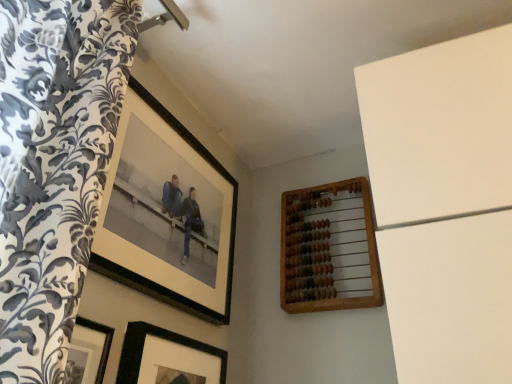
Question: Can you confirm if black matte picture frame at lower center, acting as the second picture frame starting from the left, is wider than black matte picture frame at upper left, which is the first picture frame in left-to-right order?

Choices:
 (A) yes
 (B) no

Answer: (A)

Question: Is black matte picture frame at lower center, which is counted as the second picture frame, starting from the right, oriented towards black matte picture frame at upper left, which is the first picture frame in left-to-right order?

Choices:
 (A) no
 (B) yes

Answer: (A)

Question: Considering the relative positions of black matte picture frame at lower center, acting as the second picture frame starting from the left, and black matte picture frame at upper left, which is the first picture frame in left-to-right order, in the image provided, is black matte picture frame at lower center, acting as the second picture frame starting from the left, to the right of black matte picture frame at upper left, which is the first picture frame in left-to-right order, from the viewer's perspective?

Choices:
 (A) no
 (B) yes

Answer: (B)

Question: Is black matte picture frame at lower center, acting as the second picture frame starting from the left, outside black matte picture frame at upper left, which is the first picture frame in left-to-right order?

Choices:
 (A) yes
 (B) no

Answer: (A)

Question: Can you confirm if black matte picture frame at lower center, which is counted as the second picture frame, starting from the right, is taller than black matte picture frame at upper left, which is the first picture frame in left-to-right order?

Choices:
 (A) yes
 (B) no

Answer: (B)

Question: From the image's perspective, is wooden abacus at upper right, which is counted as the 1th picture frame, starting from the right, above or below black matte picture frame at upper left, which is the first picture frame in left-to-right order?

Choices:
 (A) above
 (B) below

Answer: (B)

Question: Considering the positions of wooden abacus at upper right, which is counted as the 1th picture frame, starting from the right, and black matte picture frame at upper left, marked as the third picture frame in a right-to-left arrangement, in the image, is wooden abacus at upper right, which is counted as the 1th picture frame, starting from the right, wider or thinner than black matte picture frame at upper left, marked as the third picture frame in a right-to-left arrangement,?

Choices:
 (A) wide
 (B) thin

Answer: (A)

Question: Choose the correct answer: Is wooden abacus at upper right, arranged as the 3th picture frame when viewed from the left, inside black matte picture frame at upper left, marked as the third picture frame in a right-to-left arrangement, or outside it?

Choices:
 (A) outside
 (B) inside

Answer: (A)

Question: In terms of height, does wooden abacus at upper right, arranged as the 3th picture frame when viewed from the left, look taller or shorter compared to black matte picture frame at upper left, which is the first picture frame in left-to-right order?

Choices:
 (A) short
 (B) tall

Answer: (A)

Question: From the image's perspective, relative to black matte picture frame at upper left, which is the first picture frame in left-to-right order, is black matte picture frame at lower center, acting as the second picture frame starting from the left, above or below?

Choices:
 (A) above
 (B) below

Answer: (B)

Question: Considering the positions of black matte picture frame at lower center, which is counted as the second picture frame, starting from the right, and black matte picture frame at upper left, which is the first picture frame in left-to-right order, in the image, is black matte picture frame at lower center, which is counted as the second picture frame, starting from the right, taller or shorter than black matte picture frame at upper left, which is the first picture frame in left-to-right order,?

Choices:
 (A) short
 (B) tall

Answer: (A)

Question: Considering the positions of black matte picture frame at lower center, which is counted as the second picture frame, starting from the right, and black matte picture frame at upper left, marked as the third picture frame in a right-to-left arrangement, in the image, is black matte picture frame at lower center, which is counted as the second picture frame, starting from the right, bigger or smaller than black matte picture frame at upper left, marked as the third picture frame in a right-to-left arrangement,?

Choices:
 (A) big
 (B) small

Answer: (B)

Question: Considering the relative positions of black matte picture frame at lower center, acting as the second picture frame starting from the left, and black matte picture frame at upper left, marked as the third picture frame in a right-to-left arrangement, in the image provided, is black matte picture frame at lower center, acting as the second picture frame starting from the left, to the left or to the right of black matte picture frame at upper left, marked as the third picture frame in a right-to-left arrangement,?

Choices:
 (A) left
 (B) right

Answer: (B)

Question: Based on their positions, is black matte picture frame at upper left, marked as the third picture frame in a right-to-left arrangement, located to the left or right of wooden abacus at upper right, arranged as the 3th picture frame when viewed from the left?

Choices:
 (A) right
 (B) left

Answer: (B)

Question: From the image's perspective, is black matte picture frame at upper left, which is the first picture frame in left-to-right order, positioned above or below wooden abacus at upper right, which is counted as the 1th picture frame, starting from the right?

Choices:
 (A) below
 (B) above

Answer: (B)